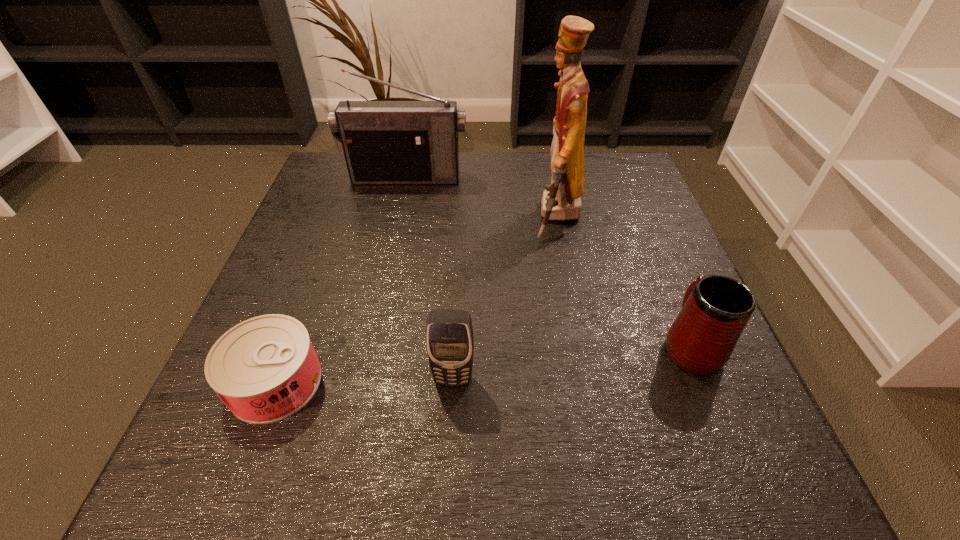
Locate an element on the screen. the second farthest object is located at coordinates (561, 200).

At what (x,y) coordinates should I click in order to perform the action: click on the fourth object from left to right. Please return your answer as a coordinate pair (x, y). Looking at the image, I should click on (561, 200).

Image resolution: width=960 pixels, height=540 pixels. I want to click on the second tallest object, so click(x=384, y=142).

The width and height of the screenshot is (960, 540). Find the location of `the farthest object`. the farthest object is located at coordinates (384, 142).

Where is `cellular telephone`? This screenshot has width=960, height=540. cellular telephone is located at coordinates (449, 333).

I want to click on the rightmost object, so click(x=715, y=310).

Identify the location of can. The width and height of the screenshot is (960, 540). (264, 369).

Image resolution: width=960 pixels, height=540 pixels. Find the location of `free space located on the front-facing side of the tallest object`. free space located on the front-facing side of the tallest object is located at coordinates (376, 217).

Locate an element on the screen. free region located on the front-facing side of the tallest object is located at coordinates (386, 217).

Where is `free space located 0.230m on the front-facing side of the tallest object`? free space located 0.230m on the front-facing side of the tallest object is located at coordinates (430, 217).